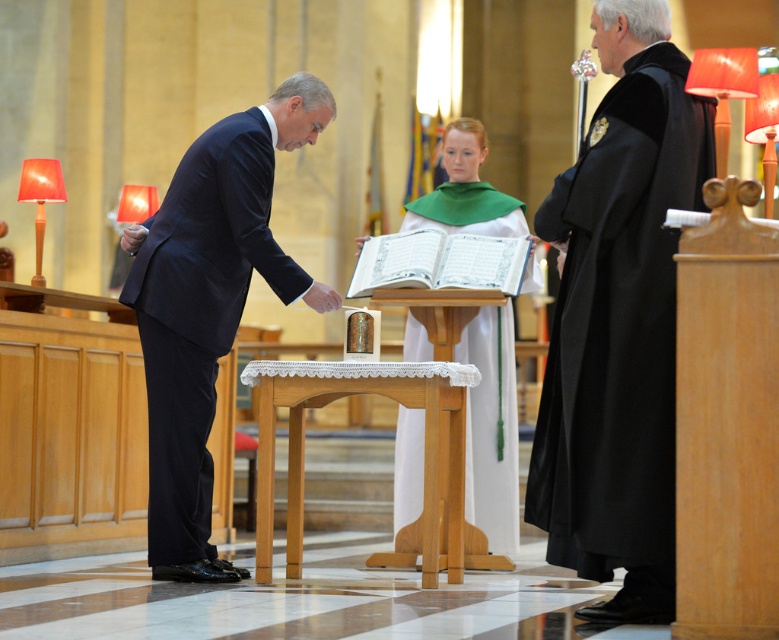
You are an event planner organizing a ceremony in this church. You need to place a decorative item on the white cloth at center that is the same size as the dark blue suit at left. Can you confirm if the item will fit on the cloth?

The dark blue suit at left has a smaller size compared to white cloth at center, so the decorative item matching the suit size will fit on the cloth.

You are a guest attending the ceremony and need to place a small offering on the wooden altar at center. However, there is a white cloth at center covering it. Where should you place the offering?

The wooden altar at center is positioned under the white cloth at center, so you should place the offering on the white cloth at center which is covering the altar.